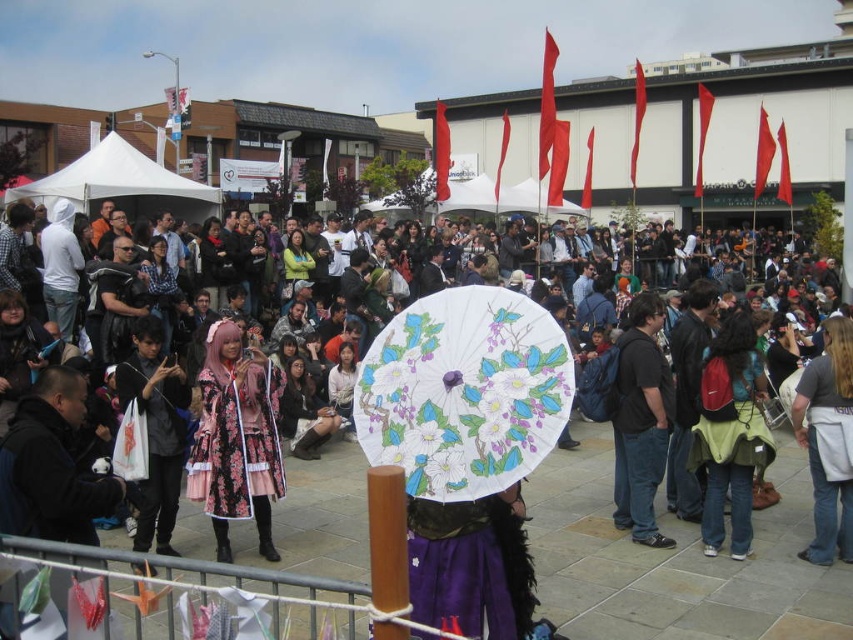
Question: Does white canvas canopy at upper left appear over floral fabric dress at center?

Choices:
 (A) yes
 (B) no

Answer: (A)

Question: Which of the following is the closest to the observer?

Choices:
 (A) matte black umbrella at center
 (B) floral-patterned fabric dress at center
 (C) green fabric backpack at center

Answer: (A)

Question: Which object is closer to the camera taking this photo?

Choices:
 (A) floral-patterned fabric dress at center
 (B) white paper umbrella at center

Answer: (B)

Question: Which point is closer to the camera?

Choices:
 (A) (297, 252)
 (B) (354, 385)
 (C) (141, 192)

Answer: (B)

Question: Can you confirm if green fabric backpack at center is bigger than floral fabric dress at center?

Choices:
 (A) yes
 (B) no

Answer: (B)

Question: From the image, what is the correct spatial relationship of matte black umbrella at center in relation to green fabric backpack at center?

Choices:
 (A) left
 (B) right

Answer: (A)